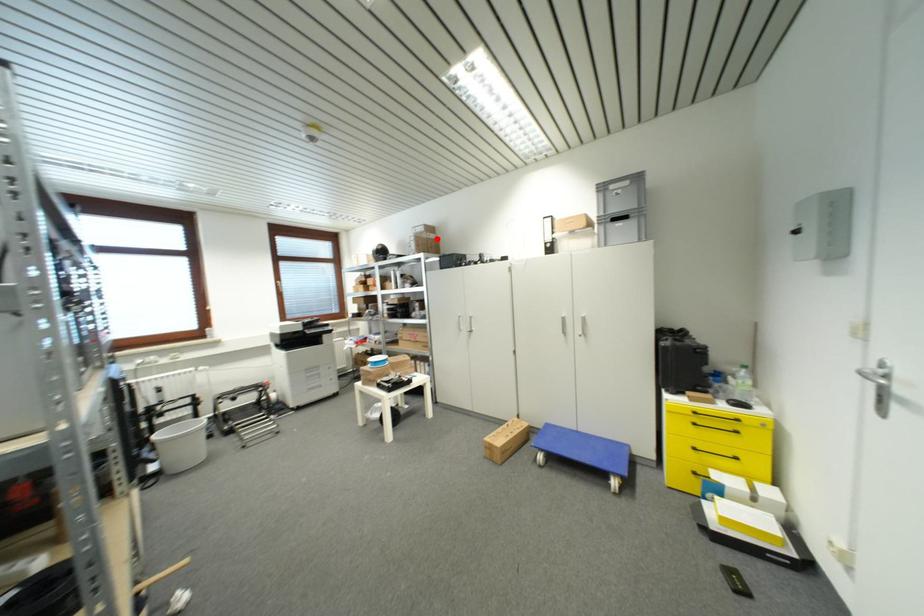
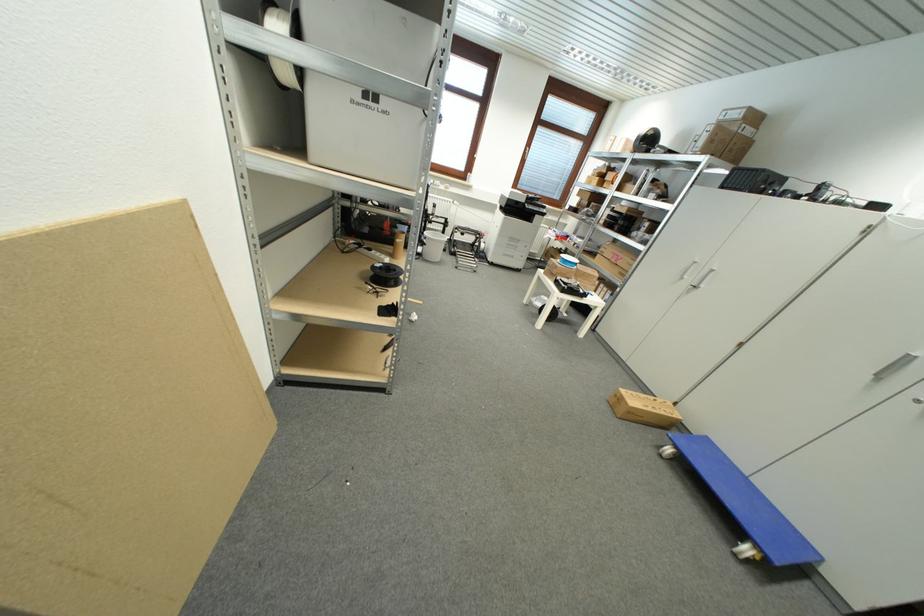
Find the pixel in the second image that matches the highlighted location in the first image.

(754, 134)